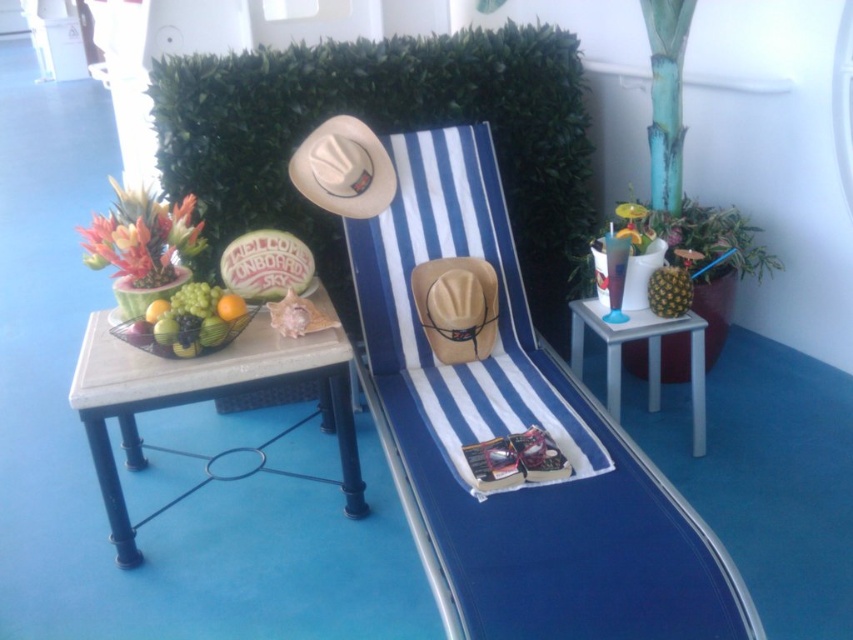
Consider the image. You are a guest at a tropical themed event and you want to grab a snack. You see the green matte grapes at left and the yellow matte pineapple at center. Which one is taller?

The green matte grapes at left is much taller than the yellow matte pineapple at center.

You are a guest at a tropical themed event and see the brown straw cowboy hat at center and the yellow matte pineapple at center. Which object would you estimate is bigger?

The brown straw cowboy hat at center is larger in size than the yellow matte pineapple at center.